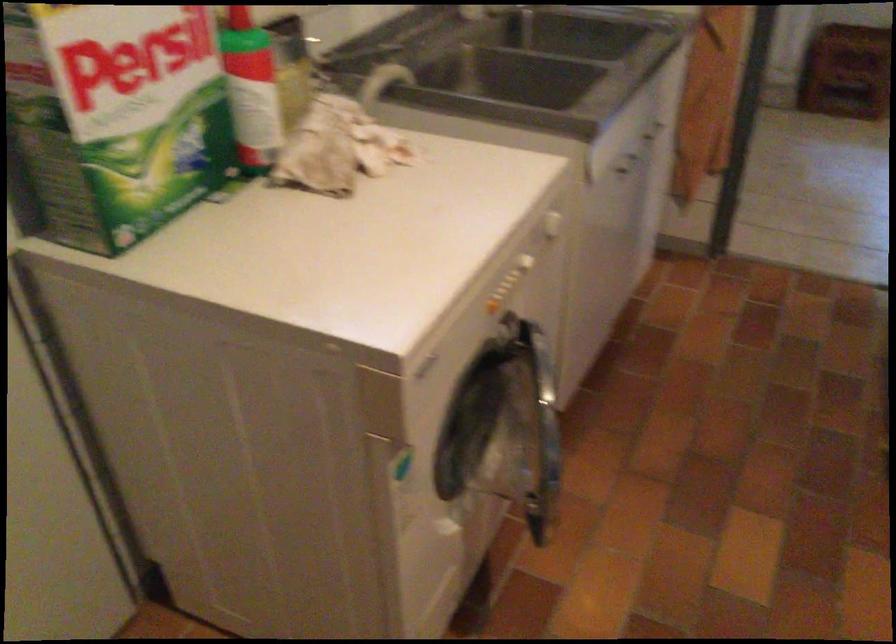
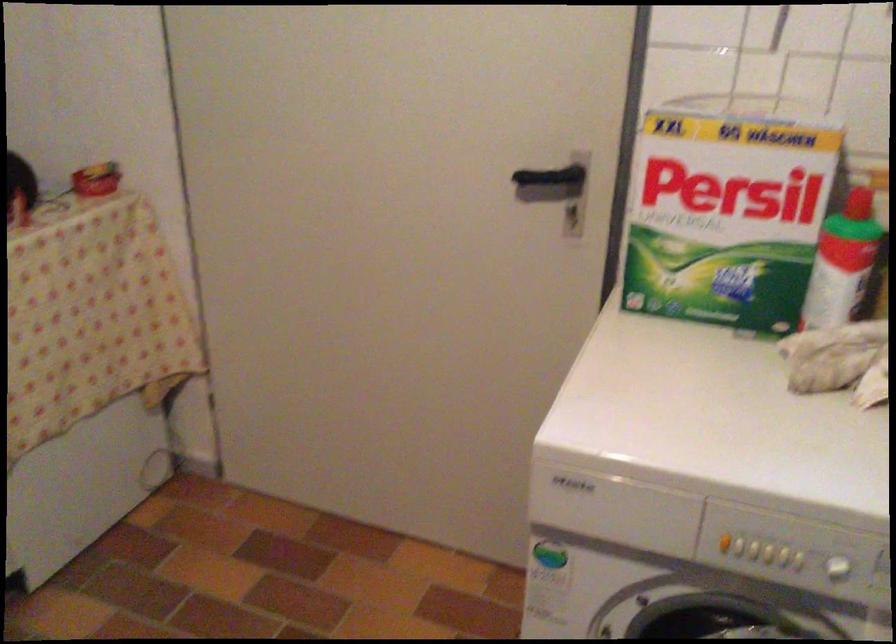
The point at [436,365] is marked in the first image. Where is the corresponding point in the second image?

(615, 509)